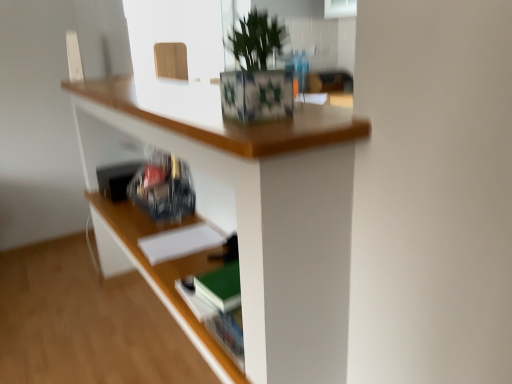
At what (x,y) coordinates should I click in order to perform the action: click on vacant area that is in front of green leafy plant at upper center. Please return your answer as a coordinate pair (x, y). This screenshot has width=512, height=384. Looking at the image, I should click on (262, 132).